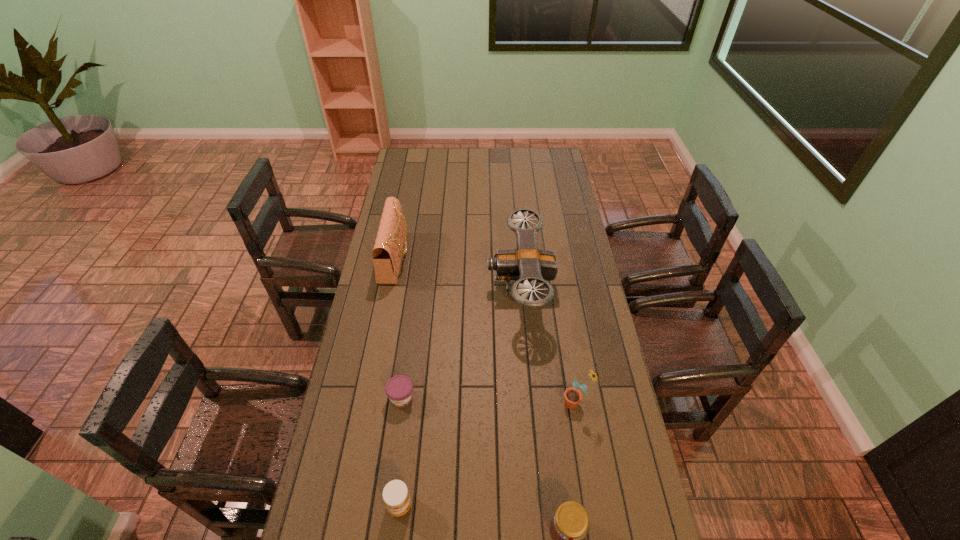
Find the location of a particular element. The width and height of the screenshot is (960, 540). free spot that satisfies the following two spatial constraints: 1. on the front-facing side of the drone; 2. on the front label of the farthest jam is located at coordinates (530, 398).